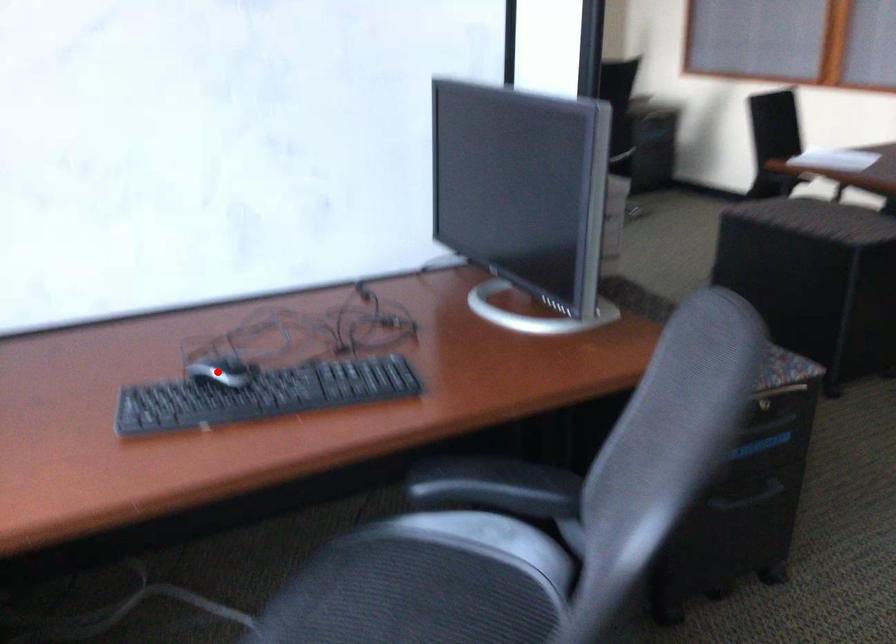
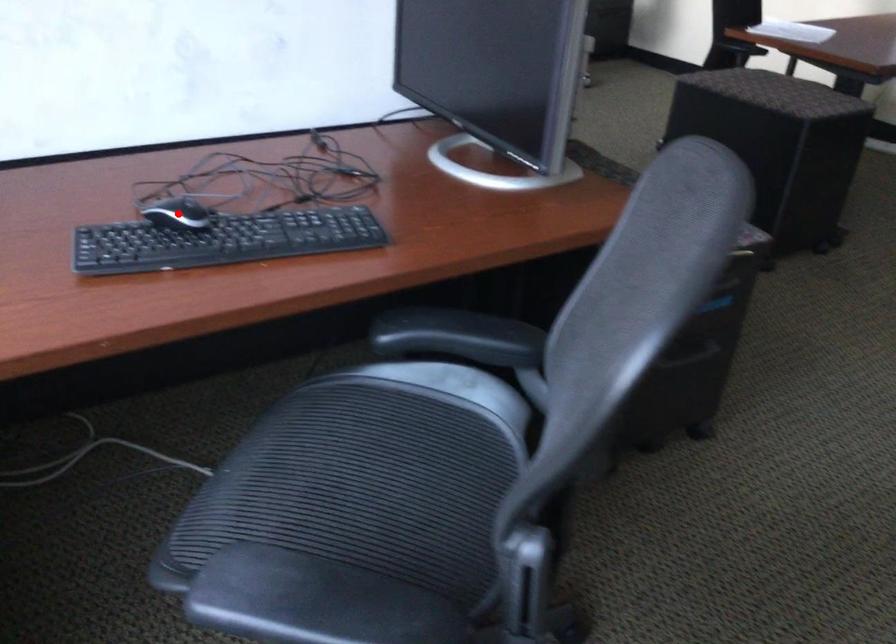
I am providing you with two images of the same scene from different viewpoints. A red point is marked on the first image and another point is marked on the second image. Are the points marked in image1 and image2 representing the same 3D position?

Yes